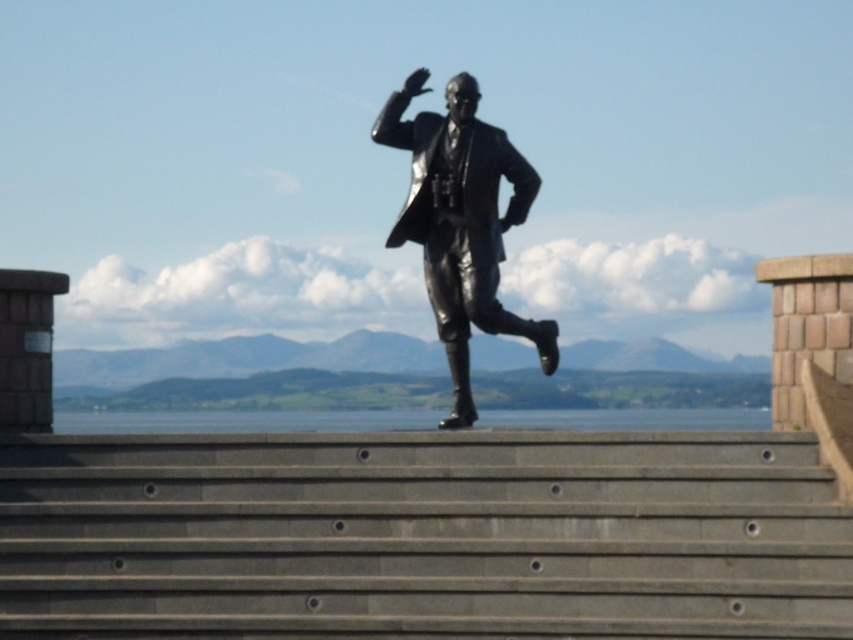
Is gray concrete stairs at center smaller than shiny bronze statue at center?

Actually, gray concrete stairs at center might be larger than shiny bronze statue at center.

Is gray concrete stairs at center wider than shiny bronze statue at center?

Yes, gray concrete stairs at center is wider than shiny bronze statue at center.

The image size is (853, 640). Find the location of `gray concrete stairs at center`. gray concrete stairs at center is located at coordinates (422, 536).

What are the coordinates of `gray concrete stairs at center` in the screenshot? It's located at (422, 536).

Does gray concrete stairs at center have a greater height compared to clear blue water at center?

Yes, gray concrete stairs at center is taller than clear blue water at center.

Between point (161, 492) and point (155, 428), which one is positioned in front?

Positioned in front is point (161, 492).

In order to click on gray concrete stairs at center in this screenshot , I will do `click(422, 536)`.

Can you confirm if shiny bronze statue at center is positioned to the left of clear blue water at center?

Incorrect, shiny bronze statue at center is not on the left side of clear blue water at center.

Does shiny bronze statue at center appear over clear blue water at center?

Yes.

Which is behind, point (520, 161) or point (753, 412)?

The point (753, 412) is more distant.

This screenshot has height=640, width=853. I want to click on shiny bronze statue at center, so click(461, 221).